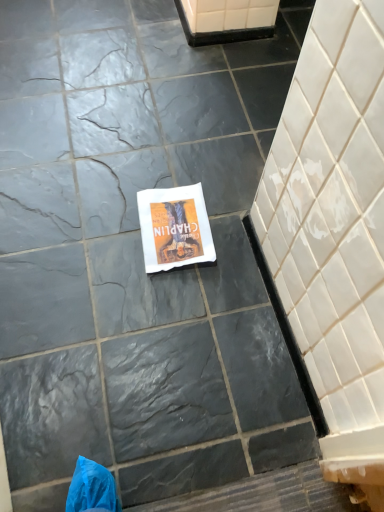
Identify the location of unoccupied area in front of white paper towel at center. The height and width of the screenshot is (512, 384). (163, 300).